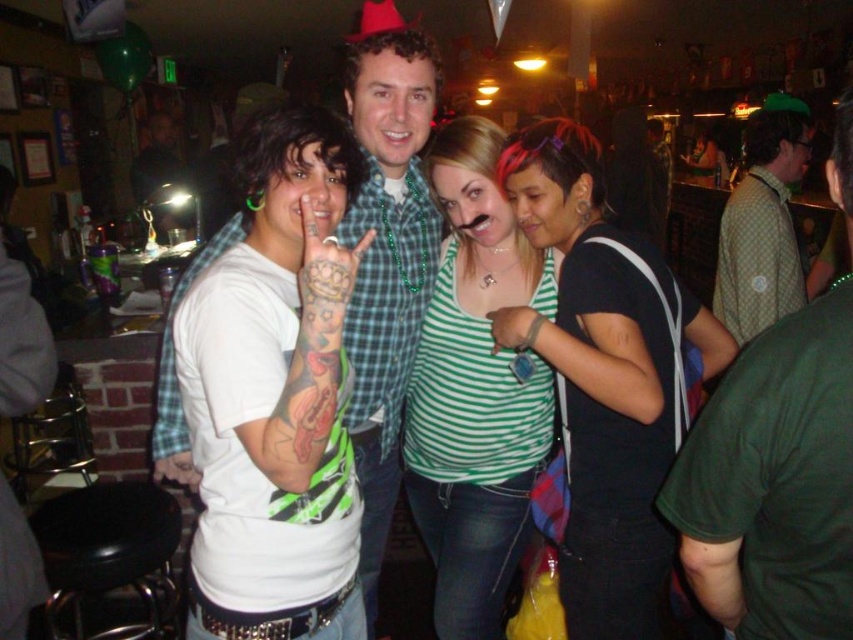
Question: Considering the real-world distances, which object is closest to the black fabric shirt at center?

Choices:
 (A) green checkered shirt at center
 (B) green striped tank top at center
 (C) matte green shirt at center
 (D) black leather stool at lower left

Answer: (B)

Question: Is black leather stool at lower left positioned behind green checkered shirt at upper right?

Choices:
 (A) no
 (B) yes

Answer: (A)

Question: Is black leather stool at lower left to the left of green checkered shirt at upper right from the viewer's perspective?

Choices:
 (A) no
 (B) yes

Answer: (B)

Question: Which object is positioned closest to the matte green shirt at center?

Choices:
 (A) black fabric shirt at center
 (B) green checkered shirt at center

Answer: (A)

Question: Which point is closer to the camera?

Choices:
 (A) black leather stool at lower left
 (B) green striped tank top at center

Answer: (B)

Question: Can you confirm if black fabric shirt at center is positioned to the left of green checkered shirt at upper right?

Choices:
 (A) no
 (B) yes

Answer: (B)